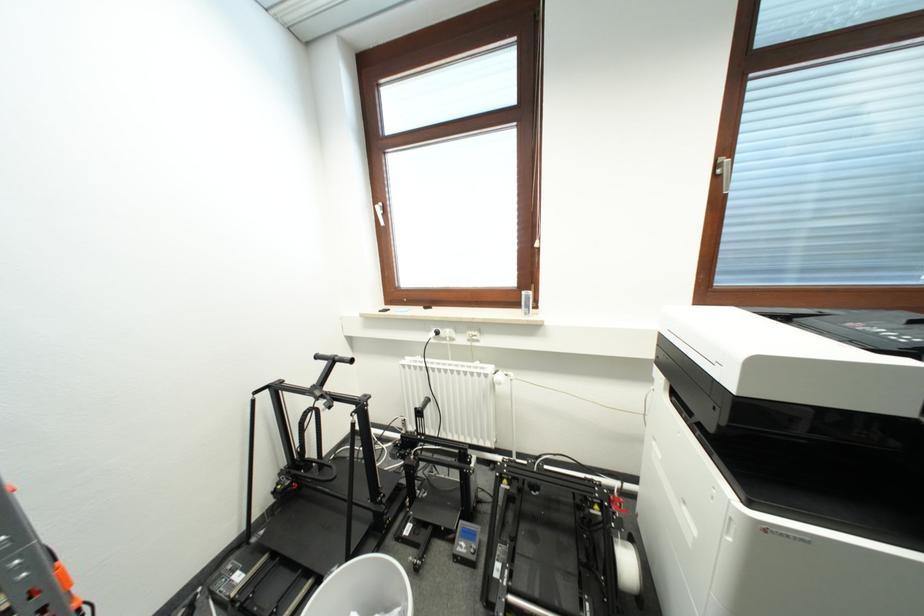
Find the location of a particular element. blinds pull cord is located at coordinates (828, 156).